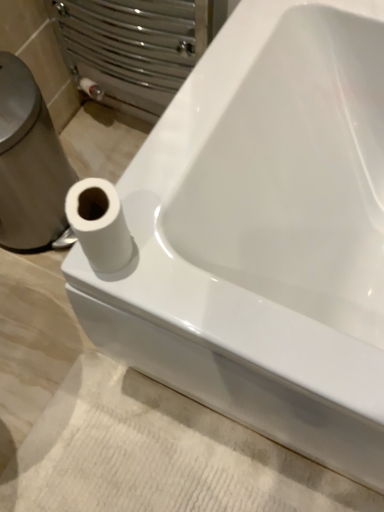
Describe the element at coordinates (99, 224) in the screenshot. This screenshot has height=512, width=384. I see `white matte toilet paper at lower left` at that location.

What do you see at coordinates (158, 454) in the screenshot? The image size is (384, 512). I see `white textured bath mat at lower left` at bounding box center [158, 454].

Measure the distance between white glossy toilet paper at left and camera.

A distance of 32.09 inches exists between white glossy toilet paper at left and camera.

At what (x,y) coordinates should I click in order to perform the action: click on white matte toilet paper at lower left. Please return your answer as a coordinate pair (x, y). The height and width of the screenshot is (512, 384). Looking at the image, I should click on (99, 224).

Are white textured bath mat at lower left and white glossy toilet paper at left located far from each other?

No, white textured bath mat at lower left is not far away from white glossy toilet paper at left.

In the scene shown: From the image's perspective, which is below, white textured bath mat at lower left or white glossy toilet paper at left?

white textured bath mat at lower left appears lower in the image.

Does white textured bath mat at lower left come behind white glossy toilet paper at left?

No, white textured bath mat at lower left is closer to the viewer.

Considering the positions of objects white textured bath mat at lower left and white glossy toilet paper at left in the image provided, who is more to the left, white textured bath mat at lower left or white glossy toilet paper at left?

Positioned to the left is white glossy toilet paper at left.

Considering the relative sizes of white glossy toilet paper at left and white matte toilet paper at lower left in the image provided, is white glossy toilet paper at left bigger than white matte toilet paper at lower left?

Yes.

You are a GUI agent. You are given a task and a screenshot of the screen. Output one action in this format:
    pyautogui.click(x=<x>, y=<y>)
    Task: Click on the toilet paper that appears above the white glossy toilet paper at left (from a real-world perspective)
    The height and width of the screenshot is (512, 384).
    Given the screenshot: What is the action you would take?
    pyautogui.click(x=99, y=224)

Which object is further away from the camera taking this photo, white glossy toilet paper at left or white matte toilet paper at lower left?

white glossy toilet paper at left is more distant.

Is white glossy toilet paper at left at the left side of white matte toilet paper at lower left?

Indeed, white glossy toilet paper at left is positioned on the left side of white matte toilet paper at lower left.

Considering the sizes of white matte toilet paper at lower left and white textured bath mat at lower left in the image, is white matte toilet paper at lower left wider or thinner than white textured bath mat at lower left?

Clearly, white matte toilet paper at lower left has less width compared to white textured bath mat at lower left.

Looking at this image, from a real-world perspective, relative to white textured bath mat at lower left, is white matte toilet paper at lower left vertically above or below?

Clearly, from a real-world perspective, white matte toilet paper at lower left is above white textured bath mat at lower left.

Can you confirm if white matte toilet paper at lower left is taller than white textured bath mat at lower left?

Indeed, white matte toilet paper at lower left has a greater height compared to white textured bath mat at lower left.

From the image's perspective, between white matte toilet paper at lower left and white textured bath mat at lower left, which one is located above?

white matte toilet paper at lower left.

Is white matte toilet paper at lower left touching white glossy toilet paper at left?

No, white matte toilet paper at lower left is not in contact with white glossy toilet paper at left.

Considering the relative sizes of white matte toilet paper at lower left and white glossy toilet paper at left in the image provided, is white matte toilet paper at lower left thinner than white glossy toilet paper at left?

Indeed, white matte toilet paper at lower left has a lesser width compared to white glossy toilet paper at left.

From the image's perspective, is white matte toilet paper at lower left beneath white glossy toilet paper at left?

Indeed, from the image's perspective, white matte toilet paper at lower left is shown beneath white glossy toilet paper at left.

In terms of size, does white glossy toilet paper at left appear bigger or smaller than white textured bath mat at lower left?

Clearly, white glossy toilet paper at left is larger in size than white textured bath mat at lower left.

Is point (11, 66) closer or farther from the camera than point (249, 468)?

Point (11, 66) is positioned closer to the camera compared to point (249, 468).

Looking at this image, which object is closer to the camera taking this photo, white glossy toilet paper at left or white textured bath mat at lower left?

white textured bath mat at lower left is more forward.

In the scene shown: Could white textured bath mat at lower left be considered to be inside white glossy toilet paper at left?

No, white textured bath mat at lower left is not a part of white glossy toilet paper at left.

Does white textured bath mat at lower left have a lesser width compared to white matte toilet paper at lower left?

No, white textured bath mat at lower left is not thinner than white matte toilet paper at lower left.

From the image's perspective, which one is positioned higher, white textured bath mat at lower left or white matte toilet paper at lower left?

white matte toilet paper at lower left is shown above in the image.

Is point (222, 501) closer or farther from the camera than point (117, 205)?

Point (222, 501) is farther from the camera than point (117, 205).

Locate an element on the screen. This screenshot has width=384, height=512. bath mat that appears below the white matte toilet paper at lower left (from a real-world perspective) is located at coordinates click(x=158, y=454).

The height and width of the screenshot is (512, 384). In order to click on bath mat that appears in front of the white glossy toilet paper at left in this screenshot , I will do `click(158, 454)`.

Where is `porcelain behind the white matte toilet paper at lower left`? This screenshot has width=384, height=512. porcelain behind the white matte toilet paper at lower left is located at coordinates (29, 163).

When comparing their distances from white glossy toilet paper at left, does white textured bath mat at lower left or white matte toilet paper at lower left seem closer?

Based on the image, white textured bath mat at lower left appears to be nearer to white glossy toilet paper at left.

Considering their positions, is white matte toilet paper at lower left positioned further to white glossy toilet paper at left than white textured bath mat at lower left?

white matte toilet paper at lower left.

Looking at the image, which one is located closer to white matte toilet paper at lower left, white textured bath mat at lower left or white glossy toilet paper at left?

white glossy toilet paper at left is closer to white matte toilet paper at lower left.

Based on their spatial positions, is white matte toilet paper at lower left or white glossy toilet paper at left further from white textured bath mat at lower left?

white matte toilet paper at lower left is further to white textured bath mat at lower left.

From the image, which object appears to be nearer to white textured bath mat at lower left, white glossy toilet paper at left or white matte toilet paper at lower left?

Among the two, white glossy toilet paper at left is located nearer to white textured bath mat at lower left.

Which object lies further to the anchor point white matte toilet paper at lower left, white glossy toilet paper at left or white textured bath mat at lower left?

white textured bath mat at lower left is further to white matte toilet paper at lower left.

Find the location of a particular element. toilet paper between white glossy toilet paper at left and white textured bath mat at lower left in the vertical direction is located at coordinates (99, 224).